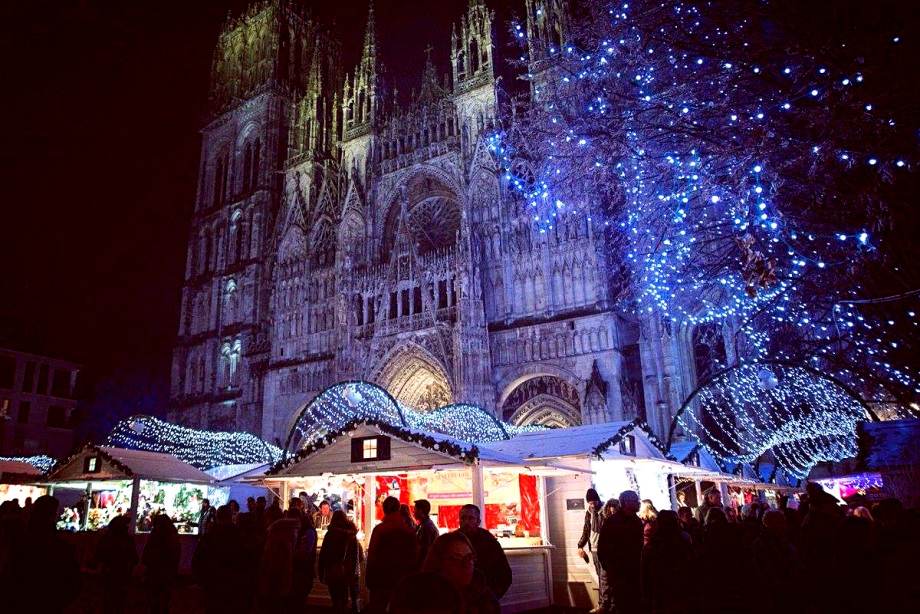
You are a GUI agent. You are given a task and a screenshot of the screen. Output one action in this format:
    pyautogui.click(x=<x>, y=<y>)
    Task: Click on the four paned window
    The height and width of the screenshot is (614, 920).
    Given the screenshot: What is the action you would take?
    pyautogui.click(x=368, y=456)